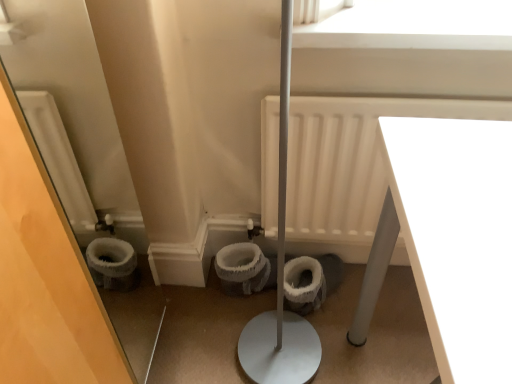
The height and width of the screenshot is (384, 512). Identify the location of empty space that is ontop of white matte window screen at upper center (from a real-world perspective). (414, 4).